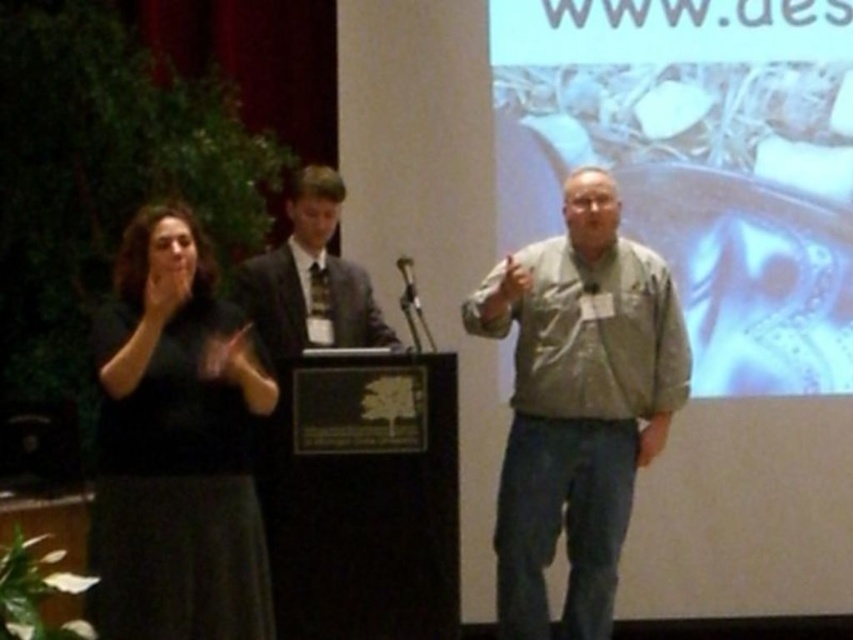
How distant is black matte dress at left from dark gray suit at center?

31.53 inches

Is black matte dress at left bigger than dark gray suit at center?

Yes.

Between point (131, 609) and point (341, 188), which one is positioned behind?

Point (341, 188)

Locate an element on the screen. black matte dress at left is located at coordinates (177, 445).

Who is taller, gray fabric shirt at center or dark gray suit at center?

With more height is gray fabric shirt at center.

Is point (677, 352) closer to viewer compared to point (335, 324)?

Yes, it is in front of point (335, 324).

Is point (645, 289) positioned behind point (256, 289)?

No.

This screenshot has width=853, height=640. Identify the location of gray fabric shirt at center. (578, 403).

Does metallic silver gear at upper right have a smaller size compared to gray fabric shirt at center?

Correct, metallic silver gear at upper right occupies less space than gray fabric shirt at center.

Between metallic silver gear at upper right and gray fabric shirt at center, which one has more height?

With more height is metallic silver gear at upper right.

The image size is (853, 640). Describe the element at coordinates (698, 163) in the screenshot. I see `metallic silver gear at upper right` at that location.

Where is `metallic silver gear at upper right`? The image size is (853, 640). metallic silver gear at upper right is located at coordinates (698, 163).